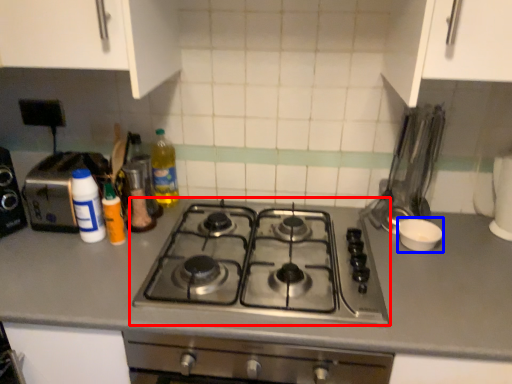
Question: Which object appears farthest to the camera in this image, gas stove (highlighted by a red box) or appliance (highlighted by a blue box)?

Choices:
 (A) gas stove
 (B) appliance

Answer: (B)